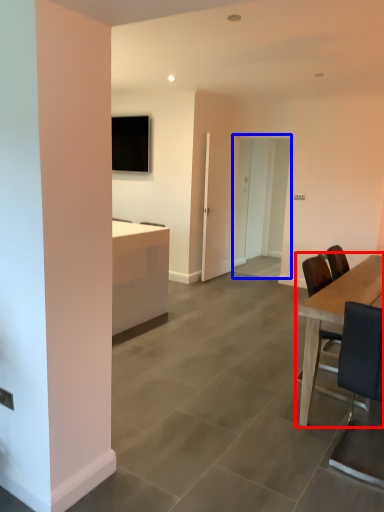
Question: Which of the following is the closest to the observer, table (highlighted by a red box) or glass door (highlighted by a blue box)?

Choices:
 (A) table
 (B) glass door

Answer: (A)